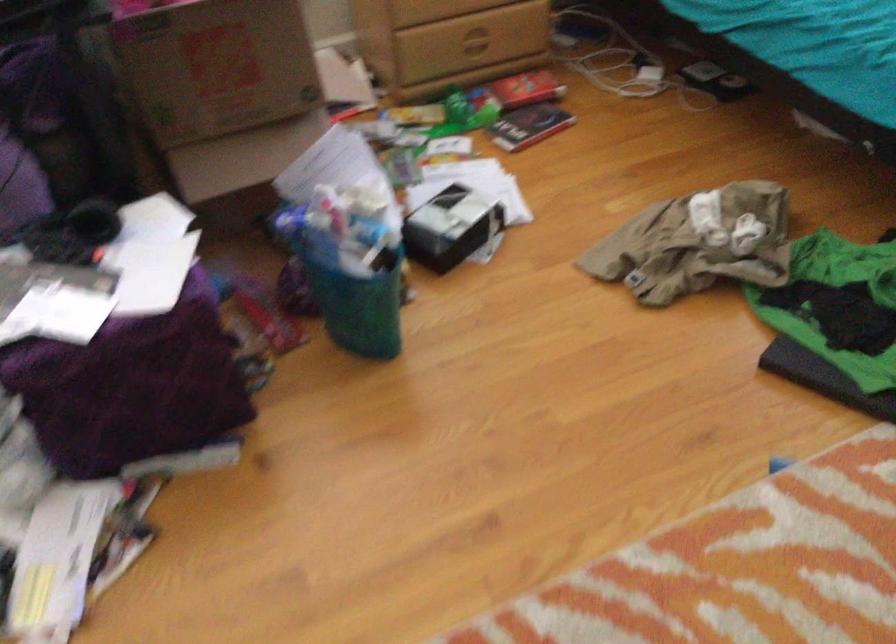
Based on the continuous images, in which direction is the camera rotating?

The camera rotated toward left-down.